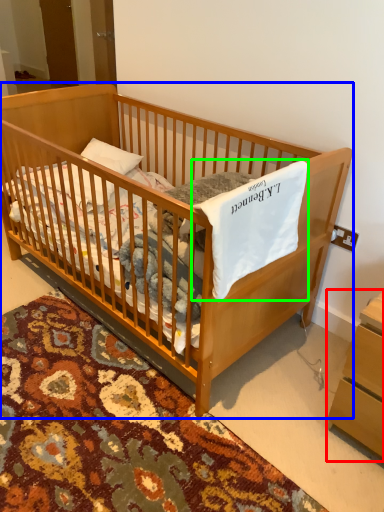
Question: Estimate the real-world distances between objects in this image. Which object is farther from changing table (highlighted by a red box), infant bed (highlighted by a blue box) or sheet (highlighted by a green box)?

Choices:
 (A) infant bed
 (B) sheet

Answer: (A)